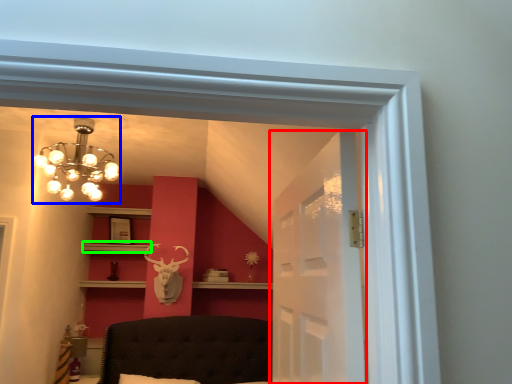
Question: Estimate the real-world distances between objects in this image. Which object is farther from glass door (highlighted by a red box), lamp (highlighted by a blue box) or shelf (highlighted by a green box)?

Choices:
 (A) lamp
 (B) shelf

Answer: (B)